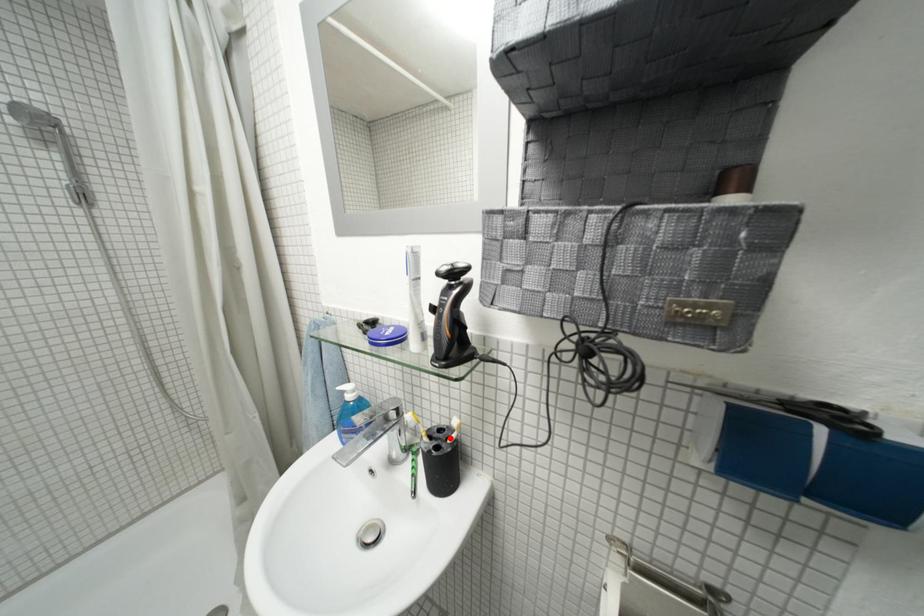
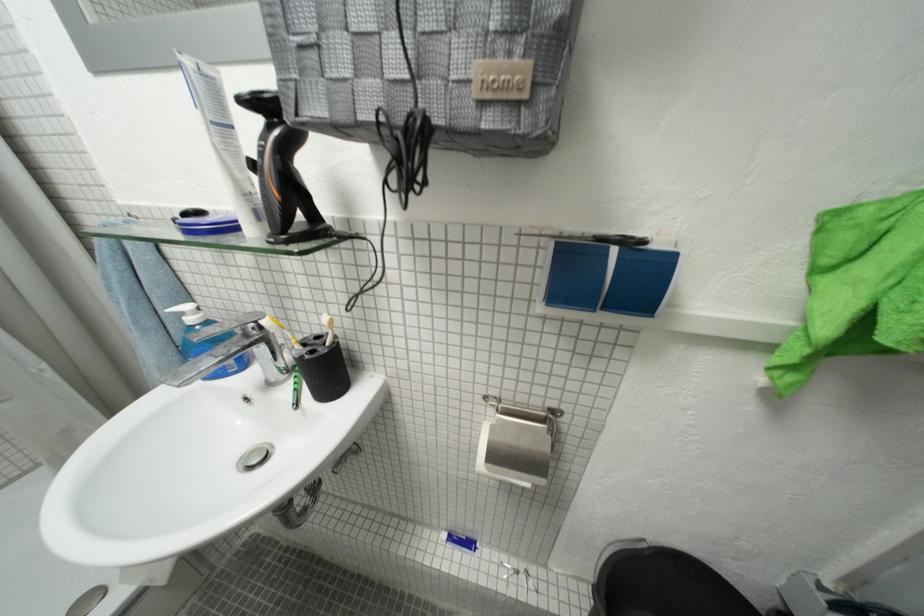
Question: I am providing you with two images of the same scene from different viewpoints. A red point is marked on the first image. At the location where the point appears in image 1, is it still visible in image 2?

Choices:
 (A) Yes
 (B) No

Answer: (A)